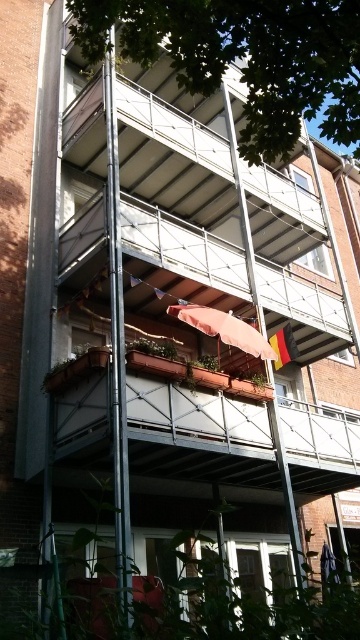
Can you confirm if green leafy tree at upper center is positioned above matte pink fabric canopy at center?

Answer: Indeed, green leafy tree at upper center is positioned over matte pink fabric canopy at center.

Between green leafy tree at upper center and matte pink fabric canopy at center, which one appears on the left side from the viewer's perspective?

From the viewer's perspective, green leafy tree at upper center appears more on the left side.

This screenshot has width=360, height=640. I want to click on green leafy tree at upper center, so click(x=245, y=58).